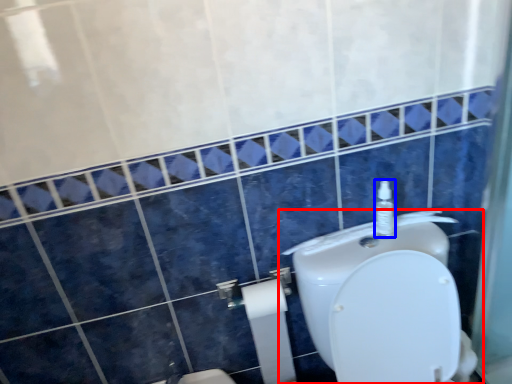
Question: Which point is closer to the camera, toilet (highlighted by a red box) or soap dispenser (highlighted by a blue box)?

Choices:
 (A) toilet
 (B) soap dispenser

Answer: (A)